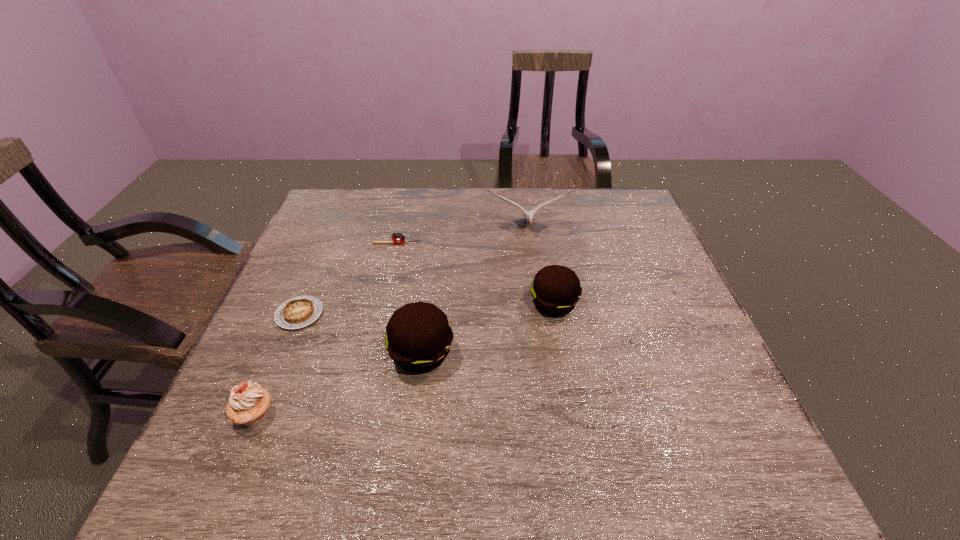
Identify the location of the left patty. (418, 338).

You are a GUI agent. You are given a task and a screenshot of the screen. Output one action in this format:
    pyautogui.click(x=<x>, y=<y>)
    Task: Click on the taller patty
    The height and width of the screenshot is (540, 960).
    Given the screenshot: What is the action you would take?
    pyautogui.click(x=418, y=338)

Find the location of a particular element. This screenshot has height=540, width=960. the shorter patty is located at coordinates (556, 289).

Identify the location of the farther patty. This screenshot has height=540, width=960. (556, 289).

Where is `tape measure`? The image size is (960, 540). tape measure is located at coordinates click(398, 238).

Locate an element on the screen. the second farthest object is located at coordinates (398, 238).

Image resolution: width=960 pixels, height=540 pixels. Identify the location of the farthest object. click(x=529, y=215).

The height and width of the screenshot is (540, 960). I want to click on the tallest object, so click(x=529, y=215).

I want to click on quiche, so click(297, 312).

Locate an element on the screen. This screenshot has height=540, width=960. cupcake is located at coordinates (249, 404).